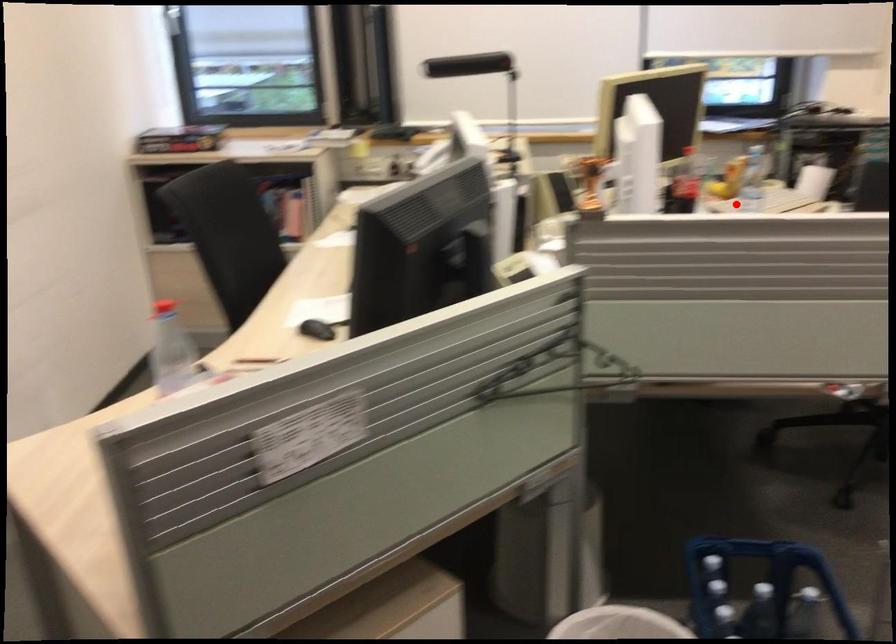
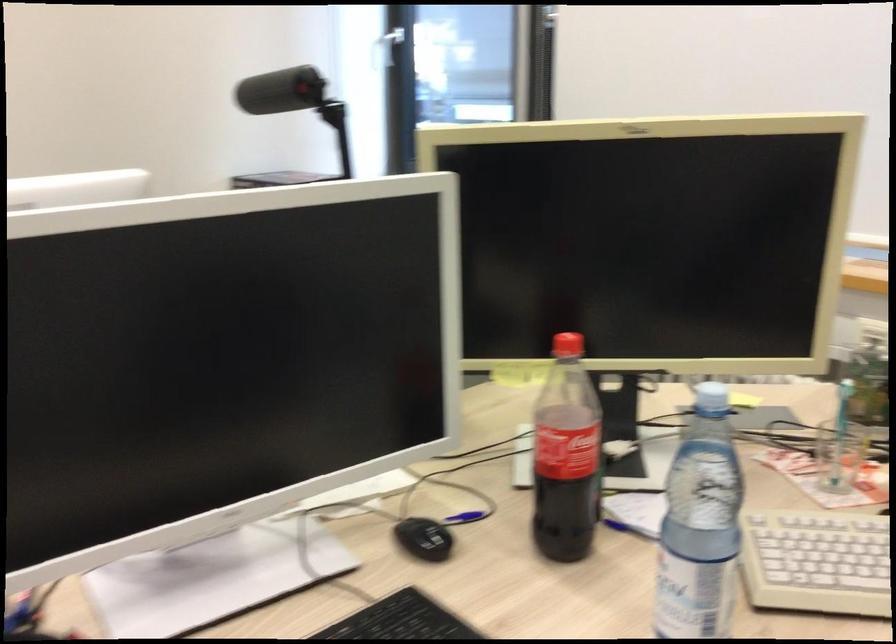
Locate, in the second image, the point that corresponds to the highlighted location in the first image.

(815, 562)